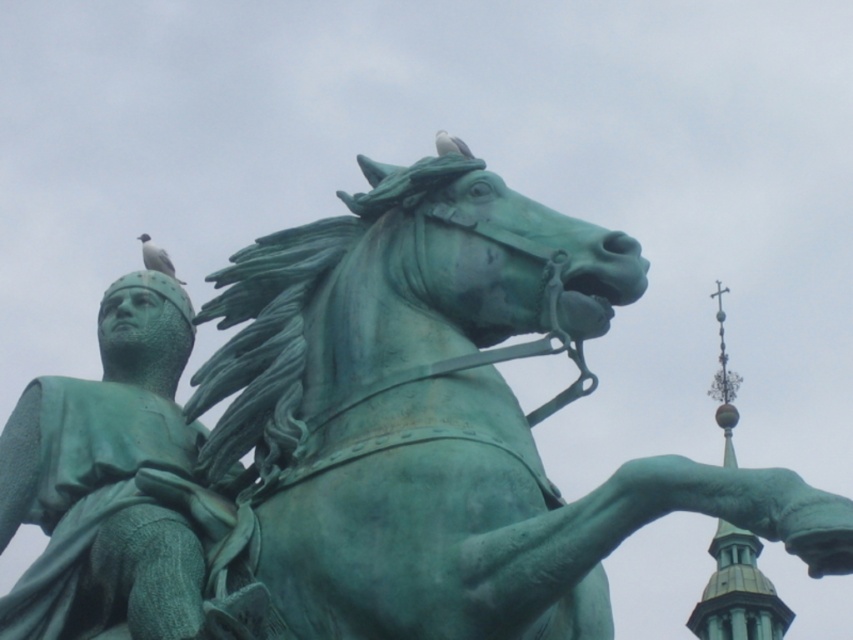
Does green copper tower at upper right have a larger size compared to white matte bird at upper left?

Yes.

Can you confirm if green copper tower at upper right is thinner than white matte bird at upper left?

Incorrect, green copper tower at upper right's width is not less than white matte bird at upper left's.

Where is `green copper tower at upper right`? This screenshot has width=853, height=640. green copper tower at upper right is located at coordinates (738, 593).

Can you confirm if green patinated bronze statue at left is positioned to the right of green copper tower at upper right?

No, green patinated bronze statue at left is not to the right of green copper tower at upper right.

Can you confirm if green patinated bronze statue at left is smaller than green copper tower at upper right?

Yes, green patinated bronze statue at left is smaller than green copper tower at upper right.

Who is more forward, (61, 566) or (759, 611)?

Point (61, 566) is in front.

Where is `green patinated bronze statue at left`? This screenshot has width=853, height=640. green patinated bronze statue at left is located at coordinates (106, 481).

Is green patinated metal horse at center taller than green patinated bronze statue at left?

Yes, green patinated metal horse at center is taller than green patinated bronze statue at left.

Which is behind, point (390, 611) or point (171, 596)?

Point (171, 596)

Is point (512, 410) positioned after point (132, 628)?

That is True.

This screenshot has height=640, width=853. Identify the location of green patinated metal horse at center. 444,410.